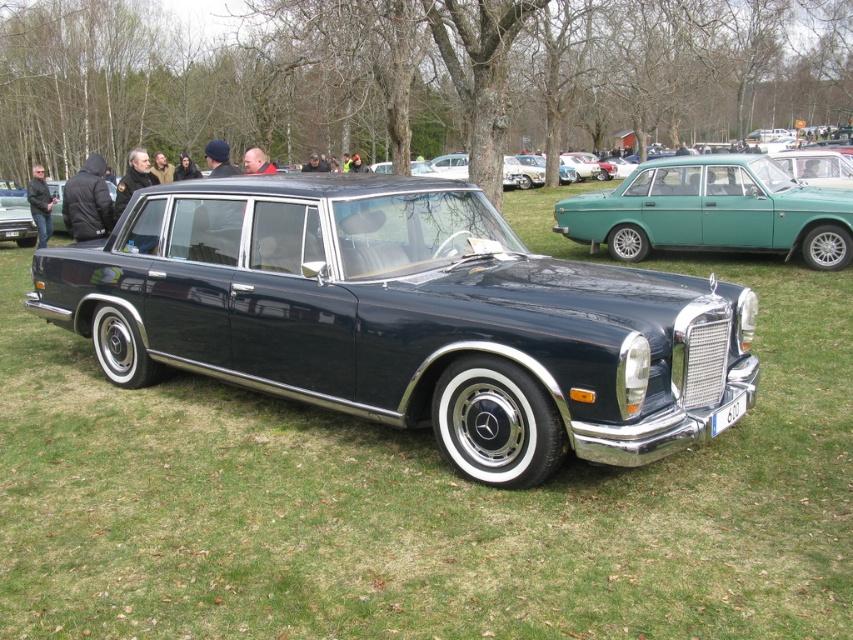
Can you confirm if shiny dark blue sedan at center is positioned to the right of white plastic license plate at lower center?

No, shiny dark blue sedan at center is not to the right of white plastic license plate at lower center.

Describe the element at coordinates (405, 317) in the screenshot. I see `shiny dark blue sedan at center` at that location.

Identify the location of shiny dark blue sedan at center. (405, 317).

Is teal matte sedan at right smaller than black leather jacket at left?

Yes.

Can you confirm if teal matte sedan at right is wider than black leather jacket at left?

No.

Measure the distance between point [717,224] and camera.

Point [717,224] is 11.13 meters from camera.

At what (x,y) coordinates should I click in order to perform the action: click on teal matte sedan at right. Please return your answer as a coordinate pair (x, y). Looking at the image, I should click on (712, 211).

Where is `teal matte sedan at right`? Image resolution: width=853 pixels, height=640 pixels. teal matte sedan at right is located at coordinates 712,211.